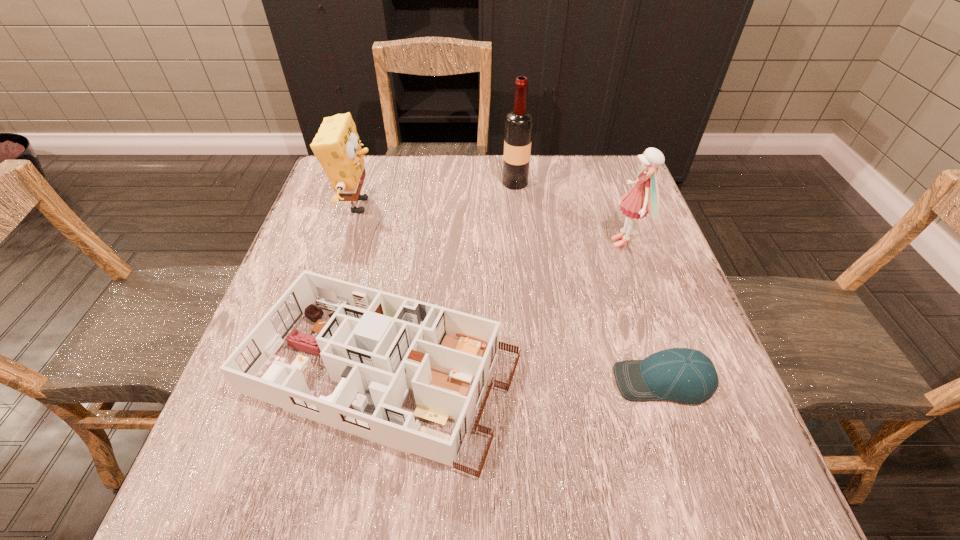
The width and height of the screenshot is (960, 540). In order to click on object at the near left corner in this screenshot , I will do `click(377, 345)`.

Locate an element on the screen. Image resolution: width=960 pixels, height=540 pixels. vacant space at the far edge of the desktop is located at coordinates (501, 200).

You are a GUI agent. You are given a task and a screenshot of the screen. Output one action in this format:
    pyautogui.click(x=<x>, y=<y>)
    Task: Click on the vacant space at the left edge of the desktop
    This screenshot has width=960, height=540.
    Given the screenshot: What is the action you would take?
    pyautogui.click(x=346, y=212)

Where is `vacant space at the right edge`? The width and height of the screenshot is (960, 540). vacant space at the right edge is located at coordinates (720, 398).

The image size is (960, 540). I want to click on vacant region at the near left corner of the desktop, so click(282, 499).

Find the location of a particular element. free area in between the doll and the baseball cap is located at coordinates [x=644, y=312].

Where is `vacant space that is in between the doll and the shortest object`? The width and height of the screenshot is (960, 540). vacant space that is in between the doll and the shortest object is located at coordinates click(x=644, y=312).

I want to click on vacant space that's between the doll and the wine bottle, so click(x=570, y=213).

Where is `free space between the baseball cap and the doll`? This screenshot has height=540, width=960. free space between the baseball cap and the doll is located at coordinates (644, 312).

What are the coordinates of `empty location between the fourth tallest object and the doll` in the screenshot? It's located at (504, 308).